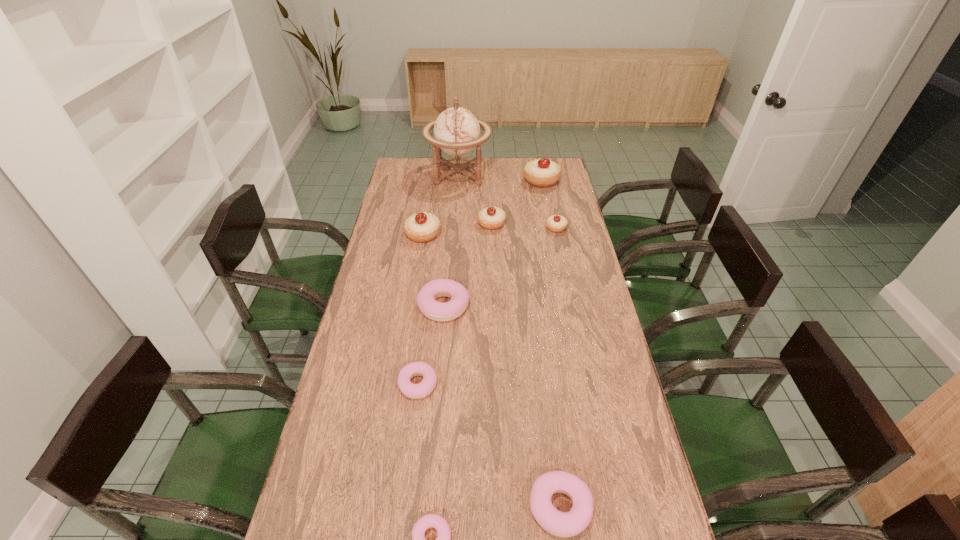
Find the location of `the sixth farthest pastry`. the sixth farthest pastry is located at coordinates pyautogui.click(x=415, y=391).

You are a GUI agent. You are given a task and a screenshot of the screen. Output one action in this format:
    pyautogui.click(x=<x>, y=<y>)
    Task: Click on the second farthest pink pastry
    
    Given the screenshot: What is the action you would take?
    pyautogui.click(x=415, y=391)

What are the coordinates of `blank space located at the front of the globe showing Africa` in the screenshot? It's located at (517, 173).

Locate an element on the screen. free region located on the front of the second tallest object is located at coordinates (551, 229).

Find the location of a particular element. vacant space located 0.220m on the back of the third tallest object is located at coordinates (429, 196).

Where is `free space located on the right of the fourth tallest object`? The height and width of the screenshot is (540, 960). free space located on the right of the fourth tallest object is located at coordinates (562, 224).

At what (x,y) coordinates should I click in order to perform the action: click on vacant region located on the front of the smallest beige pastry. Please return your answer as a coordinate pair (x, y). Image resolution: width=960 pixels, height=540 pixels. Looking at the image, I should click on (565, 273).

What are the coordinates of `vacant region located on the back of the sixth farthest object` in the screenshot? It's located at (448, 250).

You are a GUI agent. You are given a task and a screenshot of the screen. Output one action in this format:
    pyautogui.click(x=<x>, y=<y>)
    Task: Click on the blank space located 0.100m on the right of the third biggest pink pastry
    
    Given the screenshot: What is the action you would take?
    pyautogui.click(x=471, y=384)

This screenshot has width=960, height=540. Find the location of `globe that is at the far edge`. globe that is at the far edge is located at coordinates (456, 130).